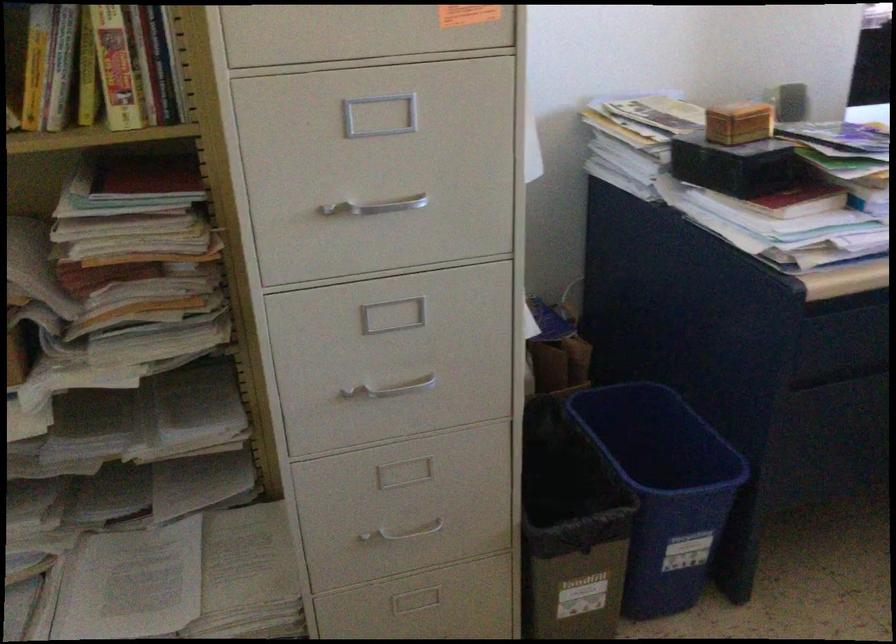
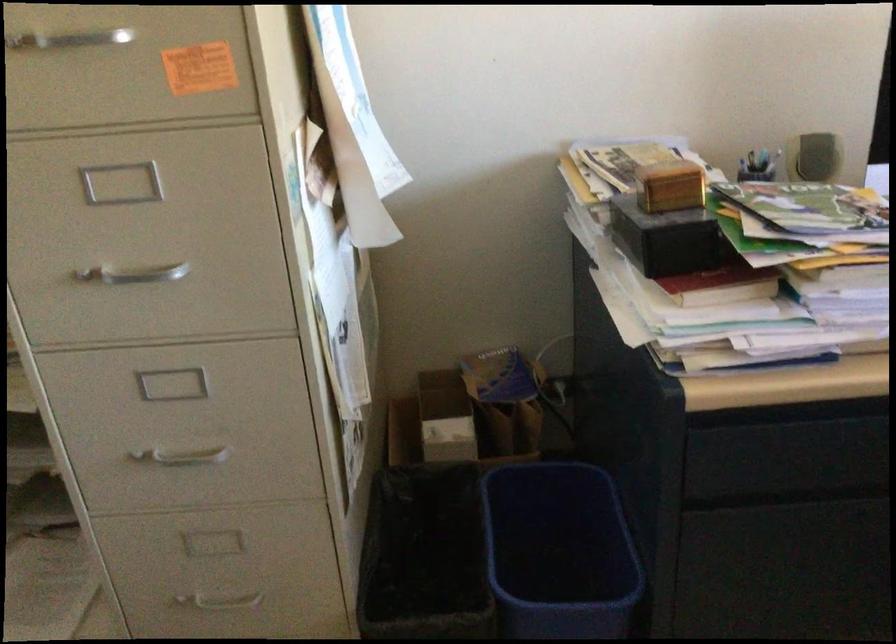
Question: The camera is either moving clockwise (left) or counter-clockwise (right) around the object. The first image is from the beginning of the video and the second image is from the end. Is the camera moving left or right when shooting the video?

Choices:
 (A) Left
 (B) Right

Answer: (B)